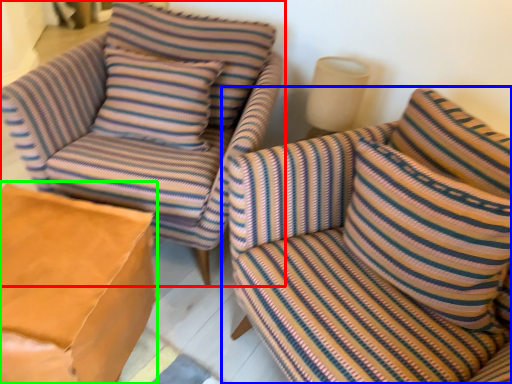
Question: Which object is the closest to the chair (highlighted by a red box)? Choose among these: studio couch (highlighted by a blue box) or table (highlighted by a green box).

Choices:
 (A) studio couch
 (B) table

Answer: (B)